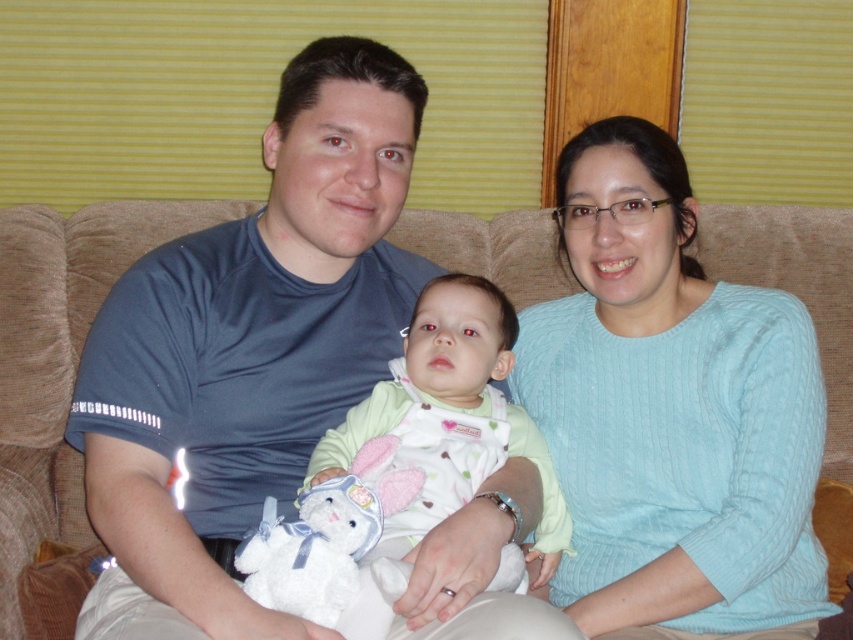
Question: Does blue cotton shirt at center appear on the left side of light blue knit sweater at center?

Choices:
 (A) yes
 (B) no

Answer: (A)

Question: Can you confirm if beige fabric couch at center is thinner than light green fabric baby at center?

Choices:
 (A) no
 (B) yes

Answer: (A)

Question: Estimate the real-world distances between objects in this image. Which object is closer to the light blue knit sweater at center?

Choices:
 (A) blue cotton shirt at center
 (B) beige fabric couch at center
 (C) light green fabric baby at center

Answer: (C)

Question: Which of the following is the closest to the observer?

Choices:
 (A) beige fabric couch at center
 (B) light green fabric baby at center
 (C) light blue knit sweater at center
 (D) blue cotton shirt at center

Answer: (D)

Question: Does light blue knit sweater at center appear on the right side of light green fabric baby at center?

Choices:
 (A) yes
 (B) no

Answer: (A)

Question: Which object is farther from the camera taking this photo?

Choices:
 (A) blue cotton shirt at center
 (B) beige fabric couch at center
 (C) light blue knit sweater at center
 (D) light green fabric baby at center

Answer: (B)